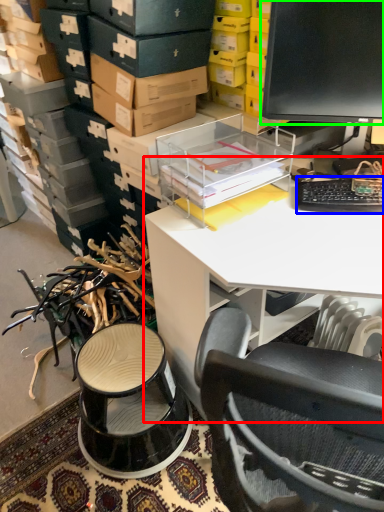
Question: Which is nearer to the desk (highlighted by a red box)? computer keyboard (highlighted by a blue box) or computer monitor (highlighted by a green box).

Choices:
 (A) computer keyboard
 (B) computer monitor

Answer: (A)